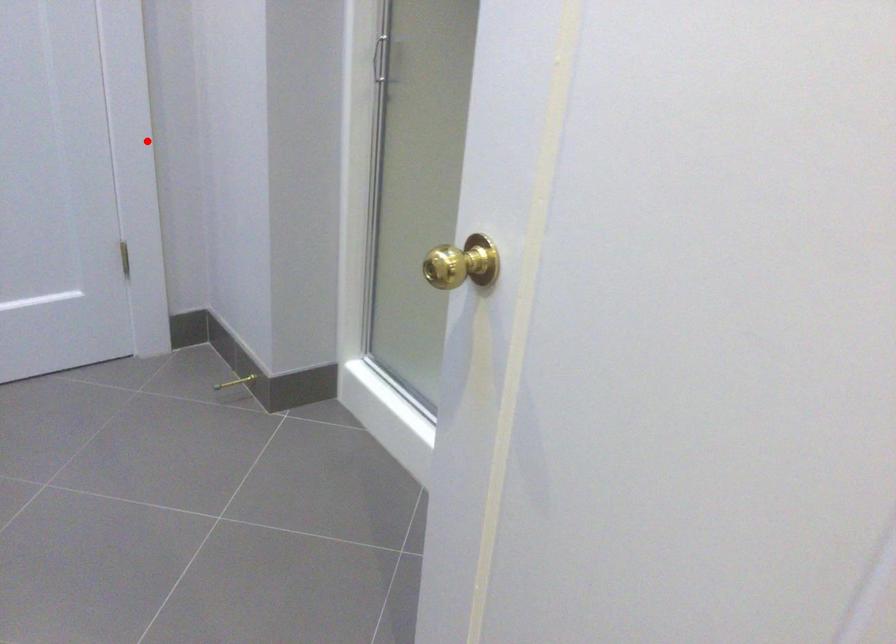
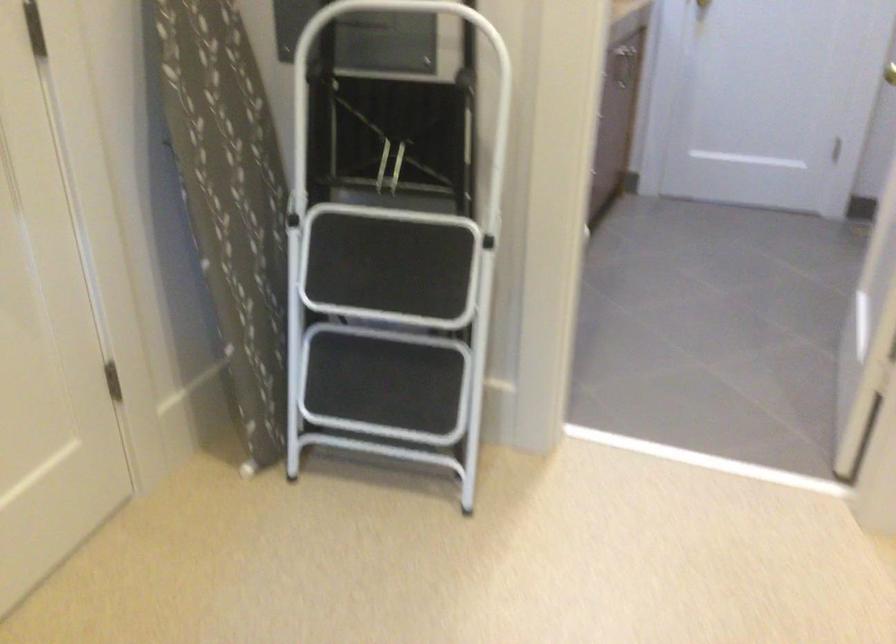
Where in the second image is the point corresponding to the highlighted location from the first image?

(890, 73)